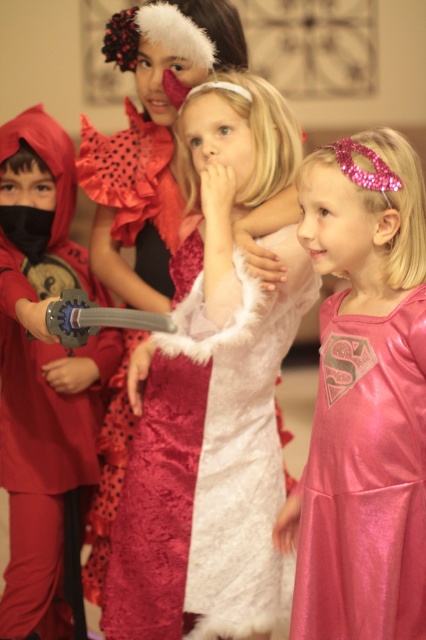
Question: Can you confirm if matte red ninja suit at left is positioned to the right of velvet dress at center?

Choices:
 (A) no
 (B) yes

Answer: (A)

Question: Does matte red ninja suit at left have a lesser width compared to velvet dress at center?

Choices:
 (A) yes
 (B) no

Answer: (A)

Question: Which object is farther from the camera taking this photo?

Choices:
 (A) velvet dress at center
 (B) matte red ninja suit at left
 (C) pink shiny dress at right

Answer: (A)

Question: Is matte red ninja suit at left smaller than velvet dress at center?

Choices:
 (A) no
 (B) yes

Answer: (A)

Question: Which point is closer to the camera?

Choices:
 (A) matte red ninja suit at left
 (B) velvet dress at center

Answer: (A)

Question: Based on their relative distances, which object is nearer to the velvet dress at center?

Choices:
 (A) pink shiny dress at right
 (B) matte red ninja suit at left

Answer: (B)